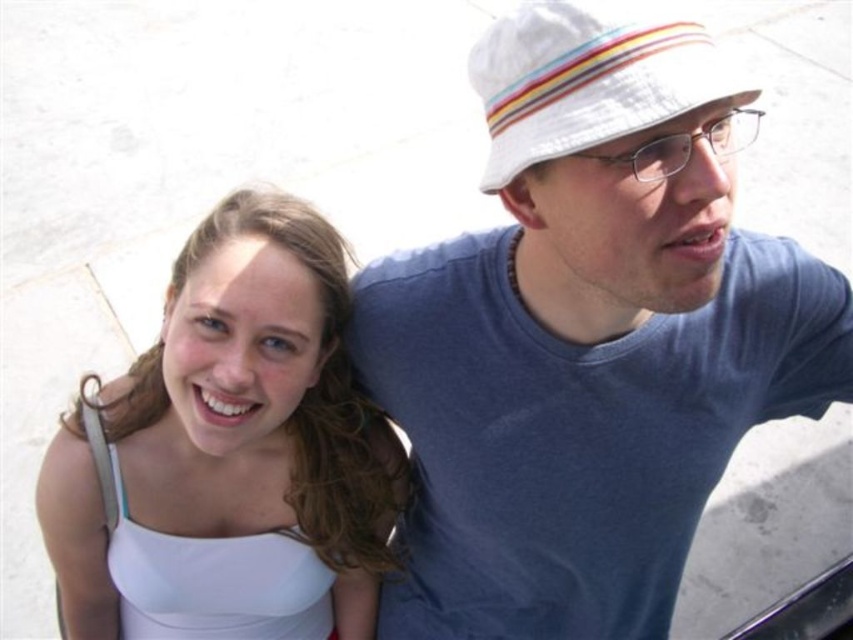
You are a photographer trying to capture a closeup of both the white cotton shirt at upper right and the white striped fabric hat at upper right in the image. Since you can only focus on one object at a time, which object should you choose to ensure the details of both are somewhat visible in the photo?

The white cotton shirt at upper right is larger in size than the white striped fabric hat at upper right, so focusing on the white cotton shirt at upper right would allow the smaller white striped fabric hat at upper right to still be somewhat visible in the background.

You are a photographer trying to capture a closeup of the clear plastic glasses at upper right and the white striped fabric hat at upper right. Since you want to focus on the hat, which object should you adjust your camera to focus on first, considering their positions?

The white striped fabric hat at upper right is located below clear plastic glasses at upper right, so you should focus on the white striped fabric hat at upper right first as it is lower in the frame.

You are a photographer trying to capture a closeup shot of the clear plastic glasses at upper right. However, the white striped fabric hat at upper right is blocking your view. Can you adjust your angle to see the glasses without moving the hat or glasses?

The white striped fabric hat at upper right is much taller than the clear plastic glasses at upper right. Therefore, adjusting your angle downward might allow you to see the clear plastic glasses at upper right below the hat.